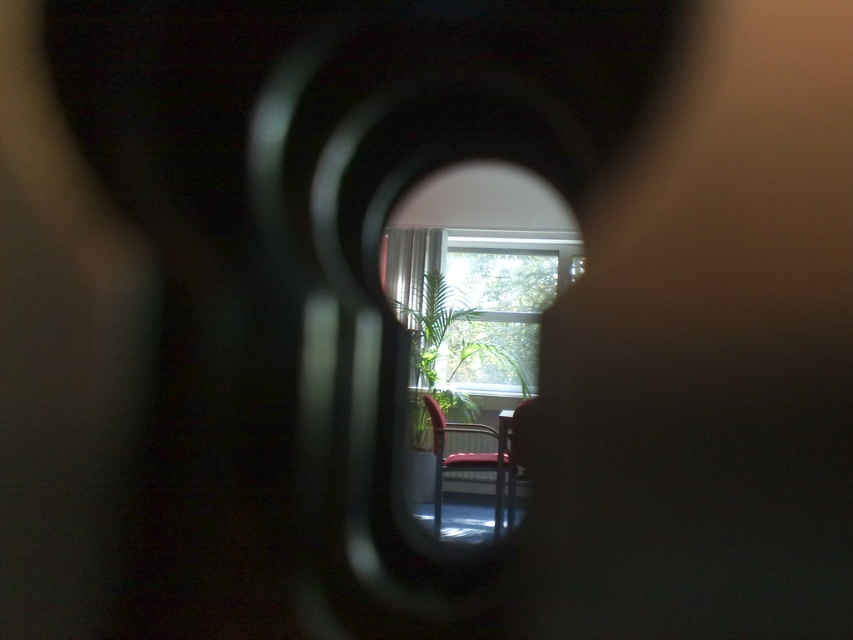
Question: Does transparent glass window at center appear on the right side of metallic red chair at center?

Choices:
 (A) yes
 (B) no

Answer: (A)

Question: Is transparent glass window at center thinner than metallic red chair at center?

Choices:
 (A) no
 (B) yes

Answer: (A)

Question: Which point appears farthest from the camera in this image?

Choices:
 (A) (480, 320)
 (B) (495, 456)

Answer: (A)

Question: Does transparent glass window at center lie behind metallic red chair at center?

Choices:
 (A) no
 (B) yes

Answer: (B)

Question: Which of the following is the farthest from the observer?

Choices:
 (A) metallic red chair at center
 (B) transparent glass window at center

Answer: (B)

Question: Which of the following is the closest to the observer?

Choices:
 (A) transparent glass window at center
 (B) metallic red chair at center

Answer: (B)